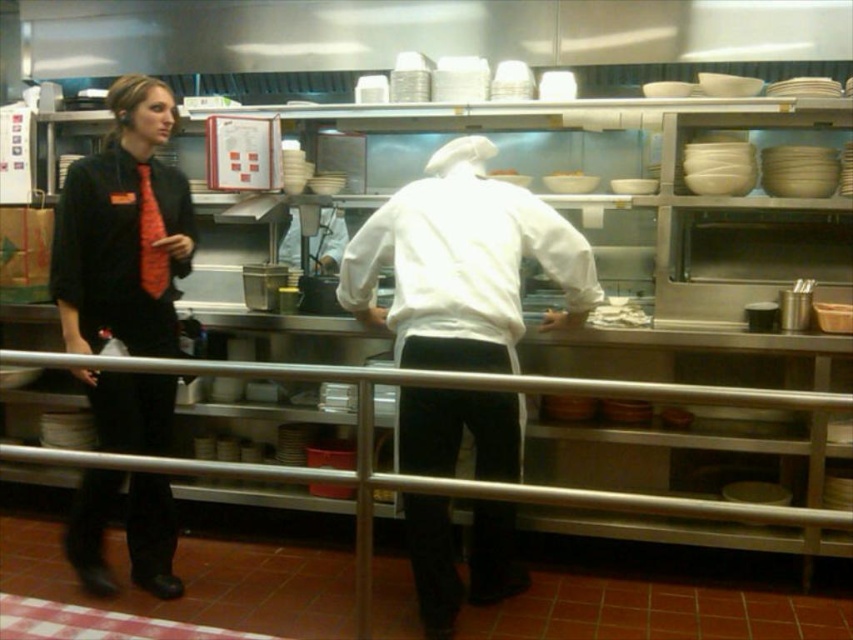
Can you confirm if white matte chef coat at center is positioned to the right of matte black jacket at left?

Correct, you'll find white matte chef coat at center to the right of matte black jacket at left.

What are the coordinates of `white matte chef coat at center` in the screenshot? It's located at (463, 264).

Identify the location of white matte chef coat at center. (463, 264).

Locate an element on the screen. The width and height of the screenshot is (853, 640). white matte chef coat at center is located at coordinates (463, 264).

How distant is white matte chef coat at center from brushed metal rail at center?

white matte chef coat at center is 33.12 inches away from brushed metal rail at center.

Who is lower down, white matte chef coat at center or brushed metal rail at center?

brushed metal rail at center is lower down.

Does point (502, 404) lie in front of point (344, 365)?

Yes, it is.

This screenshot has width=853, height=640. Identify the location of white matte chef coat at center. (463, 264).

This screenshot has width=853, height=640. What do you see at coordinates (456, 477) in the screenshot?
I see `brushed metal rail at center` at bounding box center [456, 477].

From the picture: Who is lower down, brushed metal rail at center or white matte bowl at upper center?

Positioned lower is brushed metal rail at center.

Identify the location of brushed metal rail at center. The width and height of the screenshot is (853, 640). (456, 477).